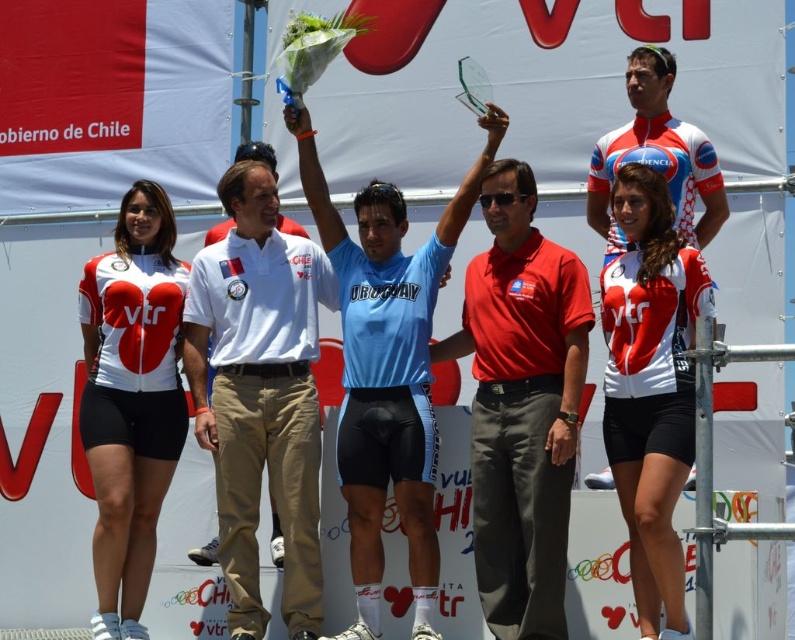
Is point (541, 474) positioned before point (664, 435)?

No, it is not.

Find the location of a particular element. The height and width of the screenshot is (640, 795). red cotton polo shirt at center is located at coordinates (522, 404).

Which of these two, red cotton polo shirt at center or white matte jersey at left, stands shorter?

With less height is red cotton polo shirt at center.

Looking at this image, is red cotton polo shirt at center thinner than white matte jersey at left?

No, red cotton polo shirt at center is not thinner than white matte jersey at left.

Identify the location of red cotton polo shirt at center. This screenshot has width=795, height=640. (522, 404).

Find the location of `red cotton polo shirt at center`. red cotton polo shirt at center is located at coordinates (522, 404).

Does white matte jersey at left have a smaller size compared to matte white jersey at center?

No, white matte jersey at left is not smaller than matte white jersey at center.

Is white matte jersey at left to the left of matte white jersey at center from the viewer's perspective?

Yes, white matte jersey at left is to the left of matte white jersey at center.

Measure the distance between point (x=134, y=384) and camera.

They are 57.73 meters apart.

The image size is (795, 640). In order to click on white matte jersey at left in this screenshot , I will do `click(130, 400)`.